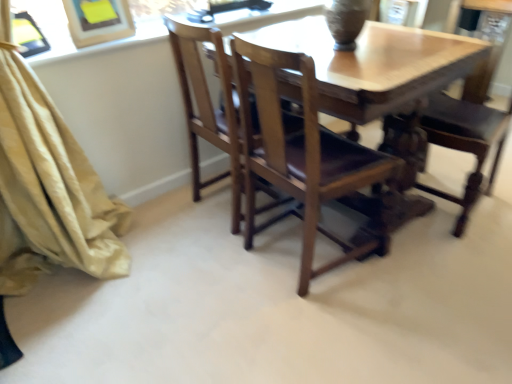
Identify the location of vacant space that's between wooden chair at center, acting as the 2th chair starting from the right, and beige fabric curtain at left. (178, 276).